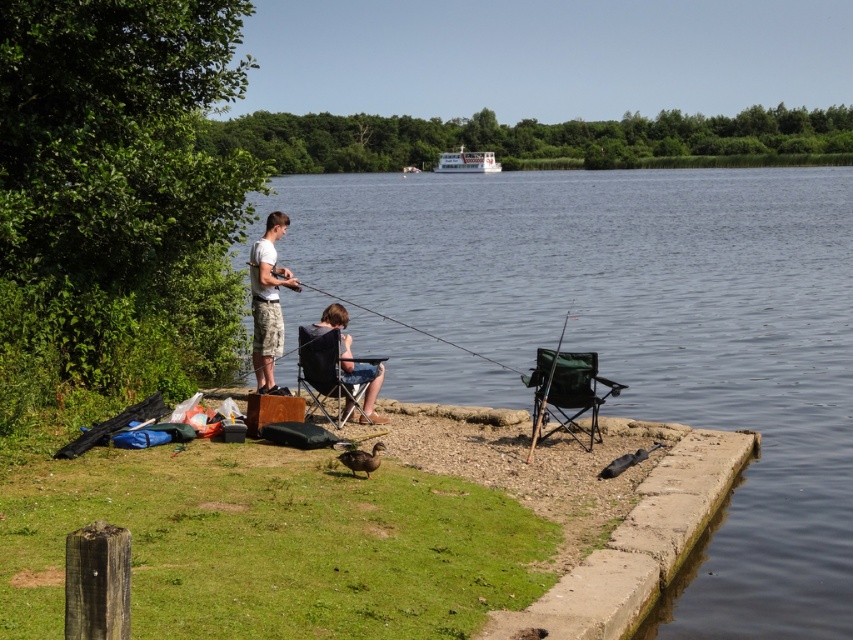
The image size is (853, 640). What do you see at coordinates (567, 390) in the screenshot? I see `green fabric chair at right` at bounding box center [567, 390].

Does green fabric chair at right come in front of matte black folding chair at center?

Yes, green fabric chair at right is in front of matte black folding chair at center.

You are a GUI agent. You are given a task and a screenshot of the screen. Output one action in this format:
    pyautogui.click(x=<x>, y=<y>)
    Task: Click on the green fabric chair at right
    The height and width of the screenshot is (640, 853).
    Given the screenshot: What is the action you would take?
    pyautogui.click(x=567, y=390)

Between point (485, 163) and point (415, 172), which one is positioned in front?

Point (485, 163)

Is white glossy boat at upper center taller than white plastic boat at upper center?

Correct, white glossy boat at upper center is much taller as white plastic boat at upper center.

What do you see at coordinates (467, 161) in the screenshot? I see `white glossy boat at upper center` at bounding box center [467, 161].

Locate an element on the screen. white glossy boat at upper center is located at coordinates (467, 161).

Is clear blue water at center closer to camera compared to green fabric fishing pole at center?

That is True.

Is clear blue water at center behind green fabric fishing pole at center?

That is False.

This screenshot has height=640, width=853. In order to click on clear blue water at center in this screenshot , I will do `click(643, 333)`.